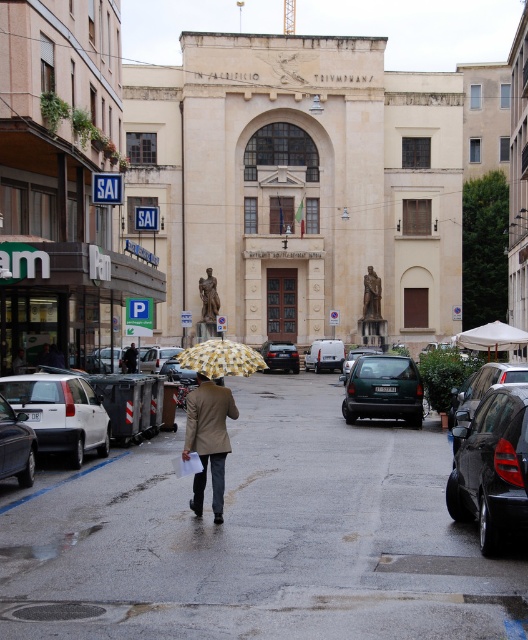
Question: Which of the following is the closest to the observer?

Choices:
 (A) (372, 353)
 (B) (12, 448)
 (C) (37, 416)

Answer: (B)

Question: Is green matte hatchback at center further to camera compared to silver metallic hatchback at left?

Choices:
 (A) no
 (B) yes

Answer: (B)

Question: Is bronze statue at center further to the viewer compared to brown leather jacket at center?

Choices:
 (A) no
 (B) yes

Answer: (B)

Question: Which object is positioned closest to the yellowmaterial/textureumbrella at center?

Choices:
 (A) tan fabric coat at center
 (B) wet asphalt pavement at center
 (C) metallic gray hatchback at center

Answer: (B)

Question: Is satin black sedan at center smaller than metallic gray hatchback at center?

Choices:
 (A) no
 (B) yes

Answer: (A)

Question: Which of the following is the closest to the observer?

Choices:
 (A) brown leather jacket at center
 (B) matte bronze statue at center
 (C) shiny black sedan at center

Answer: (C)